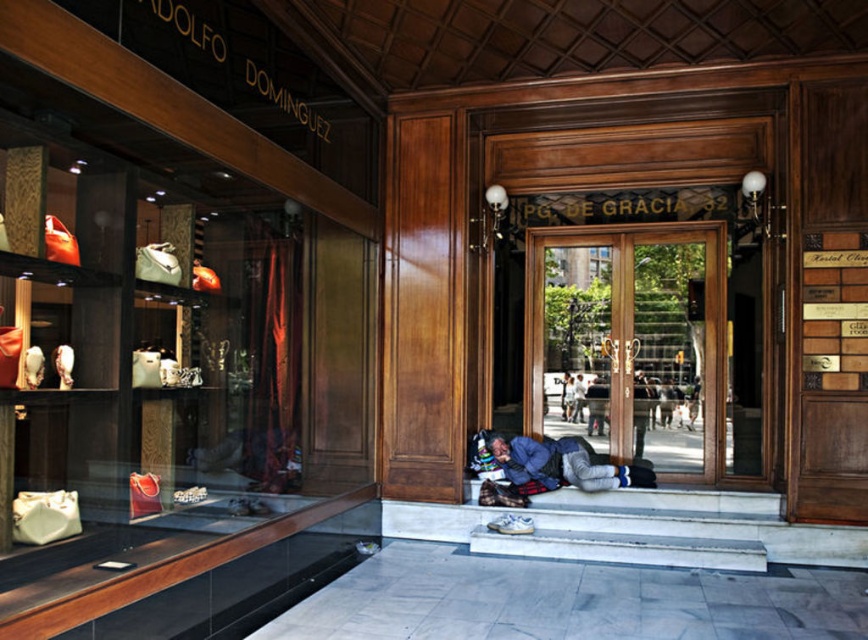
Does wooden door at center lie in front of blue denim jacket at lower center?

No, wooden door at center is further to the viewer.

The width and height of the screenshot is (868, 640). I want to click on wooden door at center, so click(629, 342).